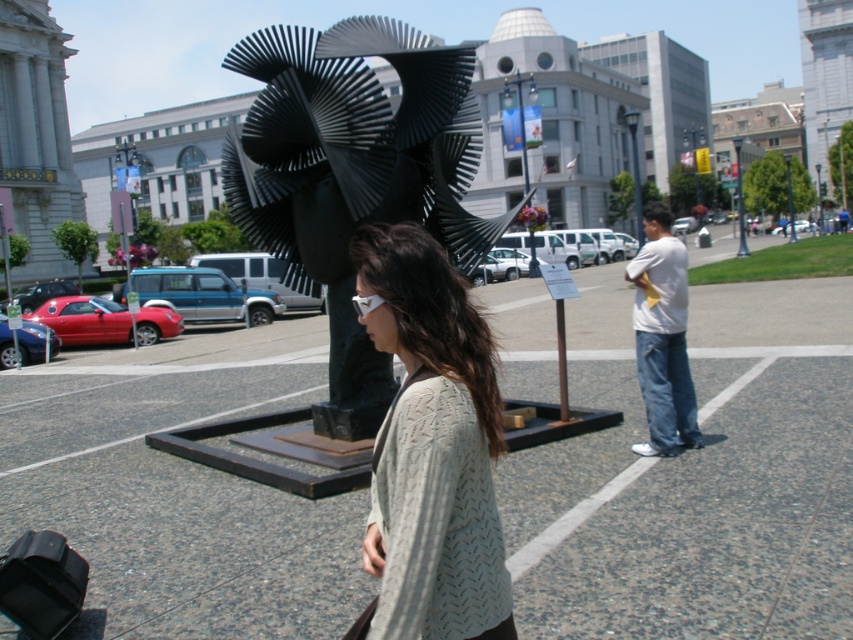
What is the relationship in height between the knitted gray sweater at center and the metallic pole at upper right?

The knitted gray sweater at center is shorter than the metallic pole at upper right.

What is the significance of the point at coordinates (352, 173) in the urban outdoor scene?

The point at coordinates (352, 173) marks the location of the black metal sculpture at center in the urban outdoor scene.